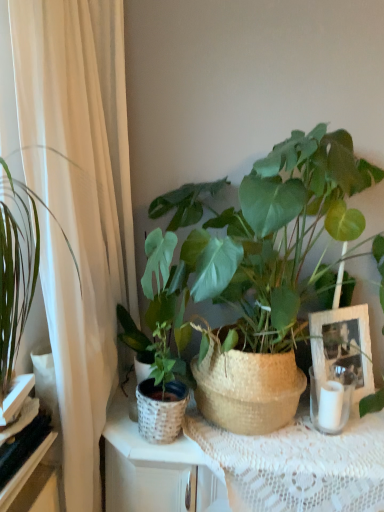
Question: From the image's perspective, is white wicker picture frame at center right positioned above or below white sheer curtain at left?

Choices:
 (A) above
 (B) below

Answer: (B)

Question: From a real-world perspective, relative to white sheer curtain at left, is white wicker picture frame at center right vertically above or below?

Choices:
 (A) above
 (B) below

Answer: (B)

Question: Which object is positioned farthest from the green woven basket at center, acting as the first houseplant starting from the right?

Choices:
 (A) green woven basket at center, acting as the 1th houseplant starting from the left
 (B) white woven basket at left, which ranks as the second shelf in bottom-to-top order
 (C) white wicker picture frame at center right
 (D) white lace tablecloth at center
 (E) black glossy shelf at lower left, which is the 1th shelf from bottom to top

Answer: (E)

Question: Estimate the real-world distances between objects in this image. Which object is farther from the black glossy shelf at lower left, arranged as the 2th shelf when viewed from the top?

Choices:
 (A) green woven basket at center, acting as the first houseplant starting from the right
 (B) white glass candle holder at right
 (C) white lace tablecloth at center
 (D) white woven basket at left, which ranks as the second shelf in bottom-to-top order
 (E) green woven basket at center, acting as the 1th houseplant starting from the left

Answer: (B)